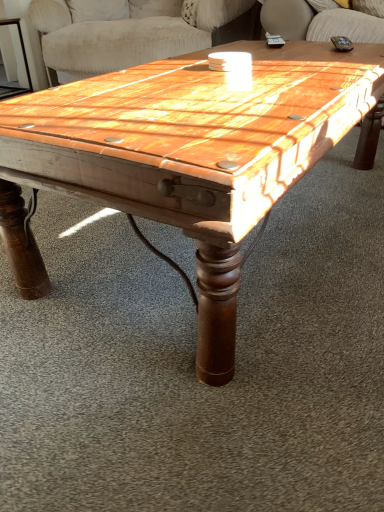
Question: Are wooden swivel chair at upper center and wooden coffee table at center far apart?

Choices:
 (A) yes
 (B) no

Answer: (A)

Question: Is wooden swivel chair at upper center further to camera compared to wooden coffee table at center?

Choices:
 (A) yes
 (B) no

Answer: (A)

Question: Is wooden swivel chair at upper center positioned in front of wooden coffee table at center?

Choices:
 (A) yes
 (B) no

Answer: (B)

Question: Could you tell me if wooden swivel chair at upper center is turned towards wooden coffee table at center?

Choices:
 (A) yes
 (B) no

Answer: (A)

Question: From the image's perspective, is wooden swivel chair at upper center under wooden coffee table at center?

Choices:
 (A) no
 (B) yes

Answer: (A)

Question: Does point (76, 33) appear closer or farther from the camera than point (21, 34)?

Choices:
 (A) farther
 (B) closer

Answer: (B)

Question: Is wooden swivel chair at upper center bigger or smaller than wooden side table at left?

Choices:
 (A) big
 (B) small

Answer: (A)

Question: Is wooden swivel chair at upper center to the left or to the right of wooden side table at left in the image?

Choices:
 (A) right
 (B) left

Answer: (A)

Question: From their relative heights in the image, would you say wooden swivel chair at upper center is taller or shorter than wooden side table at left?

Choices:
 (A) tall
 (B) short

Answer: (A)

Question: Visually, is wooden side table at left positioned to the left or to the right of wooden coffee table at center?

Choices:
 (A) left
 (B) right

Answer: (A)

Question: Considering the positions of wooden side table at left and wooden coffee table at center in the image, is wooden side table at left bigger or smaller than wooden coffee table at center?

Choices:
 (A) small
 (B) big

Answer: (A)

Question: In terms of width, does wooden side table at left look wider or thinner when compared to wooden coffee table at center?

Choices:
 (A) wide
 (B) thin

Answer: (B)

Question: Is wooden side table at left inside the boundaries of wooden coffee table at center, or outside?

Choices:
 (A) outside
 (B) inside

Answer: (A)

Question: Would you say wooden coffee table at center is to the left or to the right of wooden swivel chair at upper center in the picture?

Choices:
 (A) right
 (B) left

Answer: (A)

Question: Considering the positions of wooden coffee table at center and wooden swivel chair at upper center in the image, is wooden coffee table at center bigger or smaller than wooden swivel chair at upper center?

Choices:
 (A) big
 (B) small

Answer: (B)